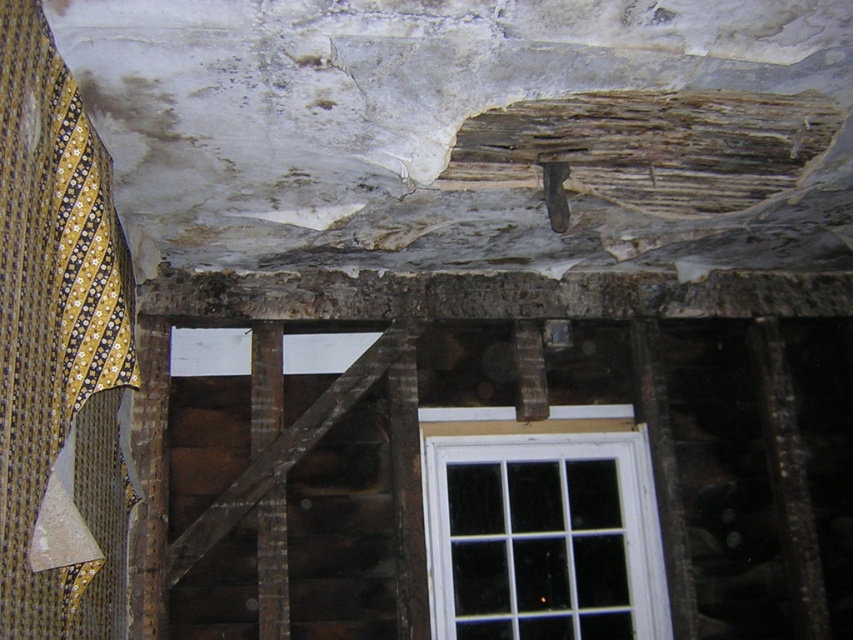
Is point (114, 605) closer to viewer compared to point (641, 512)?

That is True.

Is yellow striped fabric at left above white plastic window at lower center?

Indeed, yellow striped fabric at left is positioned over white plastic window at lower center.

This screenshot has width=853, height=640. I want to click on yellow striped fabric at left, so click(57, 349).